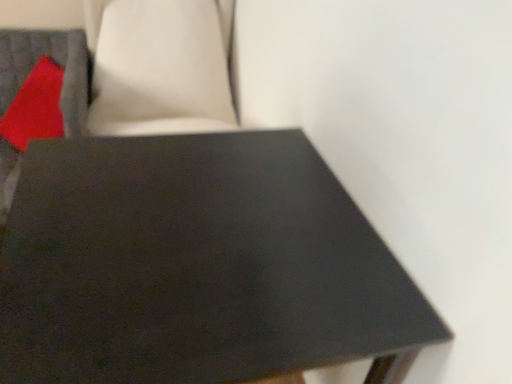
What are the coordinates of `blank space above matte black table at center (from a real-world perspective)` in the screenshot? It's located at 195,230.